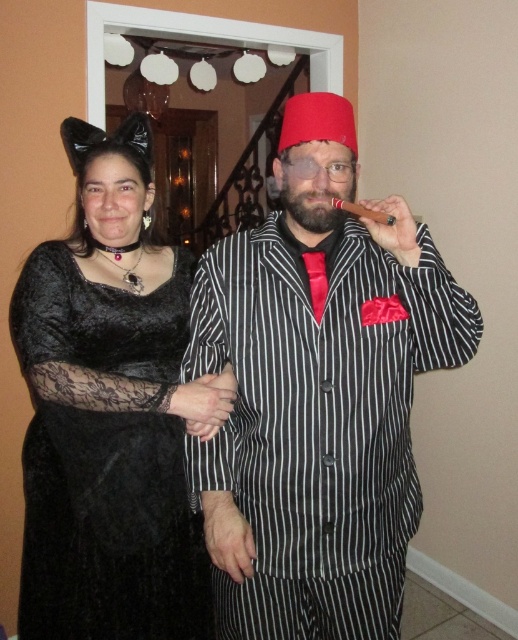
Question: Which point is closer to the camera?

Choices:
 (A) (116, 529)
 (B) (314, 472)

Answer: (B)

Question: Can you confirm if matte black pinstripe suit at center is wider than velvet black dress at center?

Choices:
 (A) no
 (B) yes

Answer: (B)

Question: Is matte black pinstripe suit at center in front of velvet black dress at center?

Choices:
 (A) yes
 (B) no

Answer: (A)

Question: Does matte black pinstripe suit at center have a larger size compared to velvet black dress at center?

Choices:
 (A) no
 (B) yes

Answer: (A)

Question: Among these objects, which one is farthest from the camera?

Choices:
 (A) velvet black dress at center
 (B) matte black pinstripe suit at center

Answer: (A)